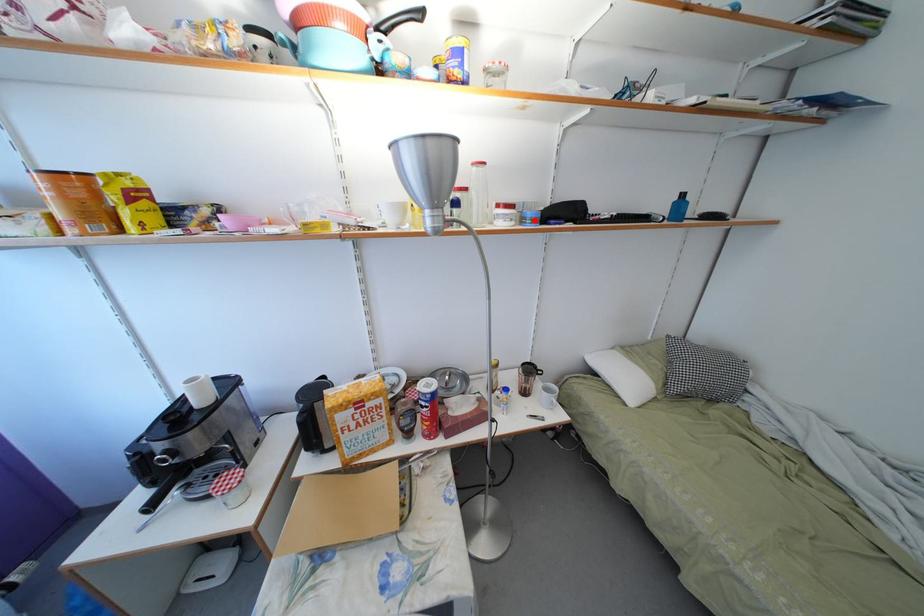
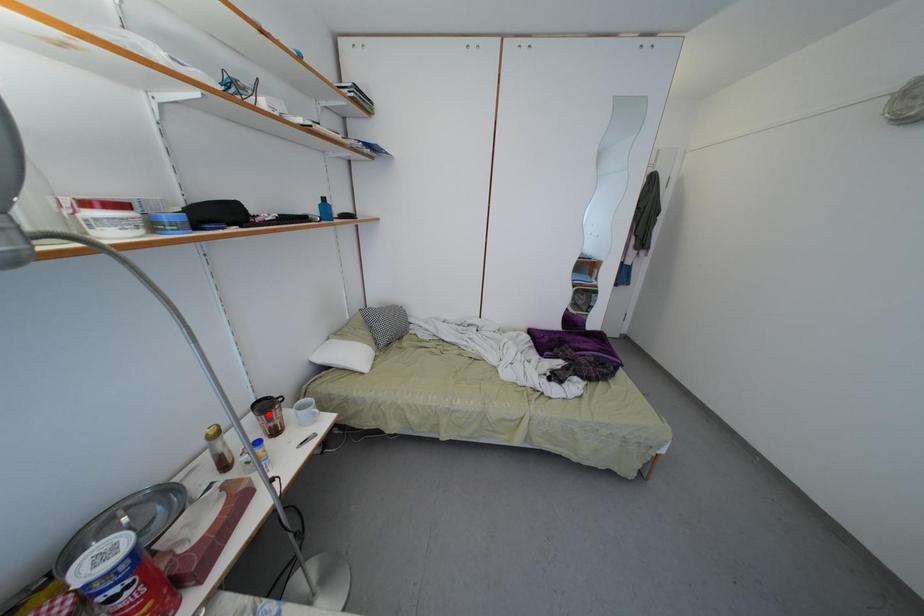
I am providing you with two images of the same scene from different viewpoints. A red point is marked on the first image and another point is marked on the second image. Is the red point in image1 aligned with the point shown in image2?

No